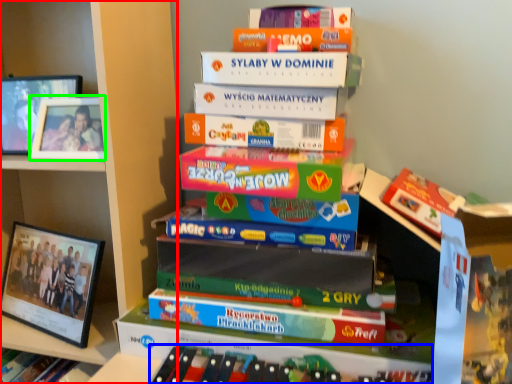
Question: Considering the real-world distances, which object is closest to bookcase (highlighted by a red box)? book (highlighted by a blue box) or picture frame (highlighted by a green box).

Choices:
 (A) book
 (B) picture frame

Answer: (B)